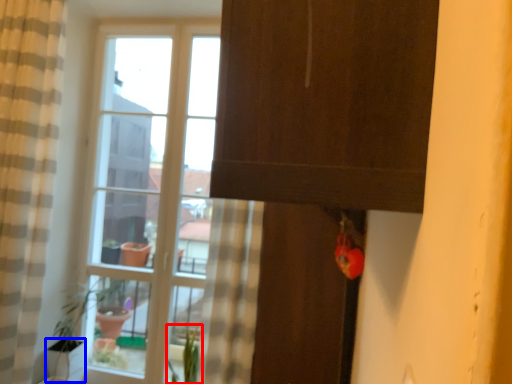
Question: Which object appears closest to the camera in this image, plant (highlighted by a red box) or glass vase (highlighted by a blue box)?

Choices:
 (A) plant
 (B) glass vase

Answer: (A)